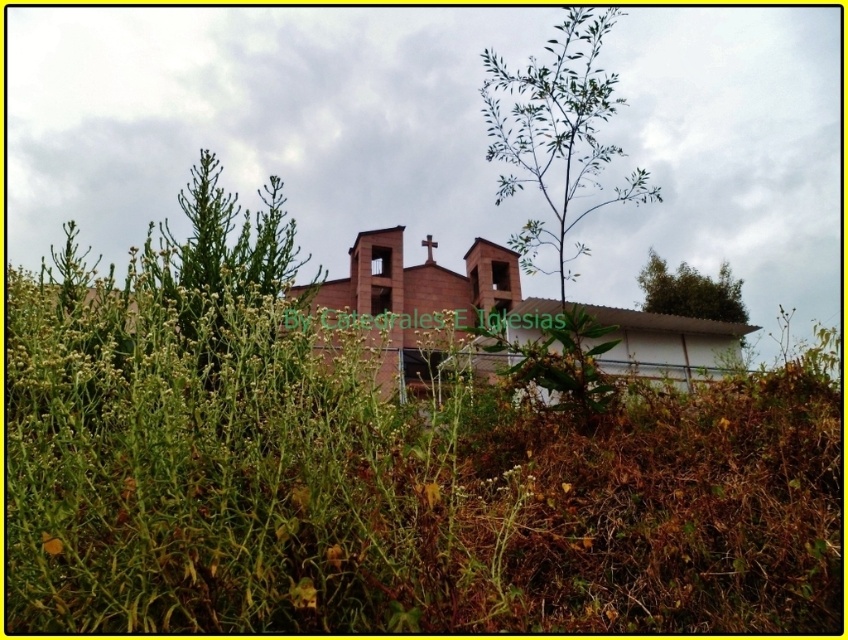
You are planning to take a photo of the red brick church at center and the green leafy plant at left. If you want both subjects to be clearly visible in the frame, which one should you focus on to ensure proper scaling?

The red brick church at center is wider than the green leafy plant at left, so focusing on the red brick church at center would ensure proper scaling for both subjects to be clearly visible in the frame.

You are standing in a field and want to take a photo of both the red brick church at center and the green leafy tree at upper right. Which object will appear larger in your photo?

The red brick church at center will appear larger in your photo because it is closer to the viewer than the green leafy tree at upper right.